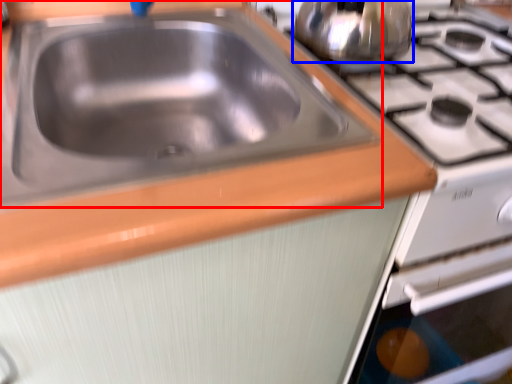
Question: Which of the following is the closest to the observer, sink (highlighted by a red box) or tea pot (highlighted by a blue box)?

Choices:
 (A) sink
 (B) tea pot

Answer: (A)